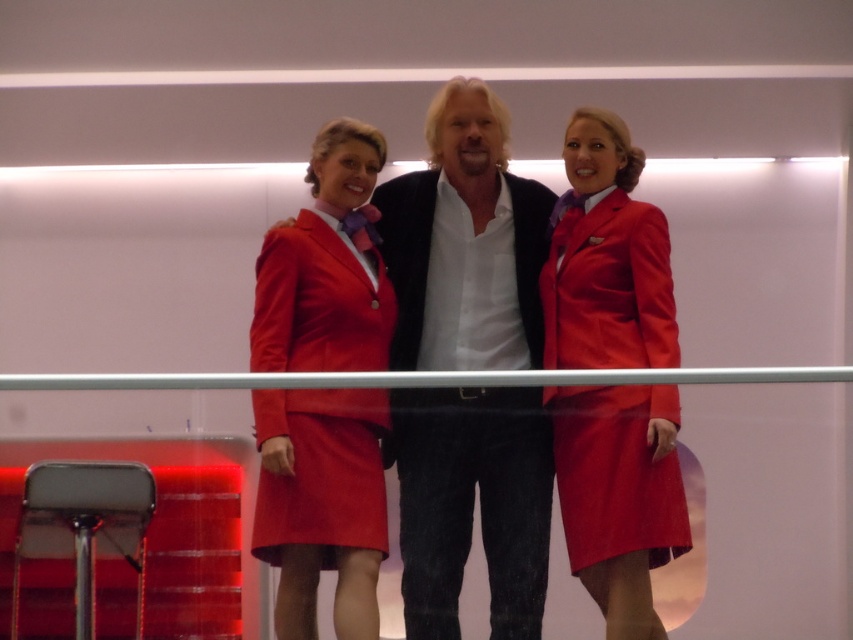
You are a photographer setting up for a group photo. You need to position yourself so that both the matte red uniform at center and the matte red uniform at right are in your camera frame. Given that your camera has a maximum horizontal field of view of 30 inches, will you be able to capture both uniforms in a single shot?

The distance between the matte red uniform at center and the matte red uniform at right is 28.92 inches, which is less than the camera field of view of 30 inches. Therefore, you can capture both uniforms in a single shot.

You are at an event and need to take a photo of the two women in red. The matte red uniform at right and the matte red dress at center are both in frame. Which one is positioned to the right side of the other?

The matte red uniform at right is positioned to the right of the matte red dress at center.

You are standing in the room and want to reach both the point at coordinates point (x=589, y=422) and point (x=283, y=490). Which point will you reach first?

You will reach point (x=589, y=422) first because it is closer to you than point (x=283, y=490), which is further away.